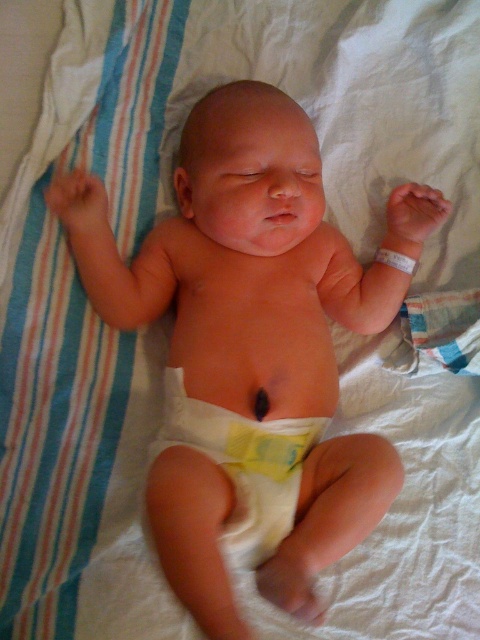
Based on the scene description, can you determine the position of the smooth skin baby at center relative to the white cloth diaper at center?

The smooth skin baby at center is positioned on the right side of the white cloth diaper at center.

Based on the scene, can you determine which object is bigger between the smooth skin baby at center and the white cloth diaper at center?

The smooth skin baby at center has a larger size compared to the white cloth diaper at center, so the baby is bigger.